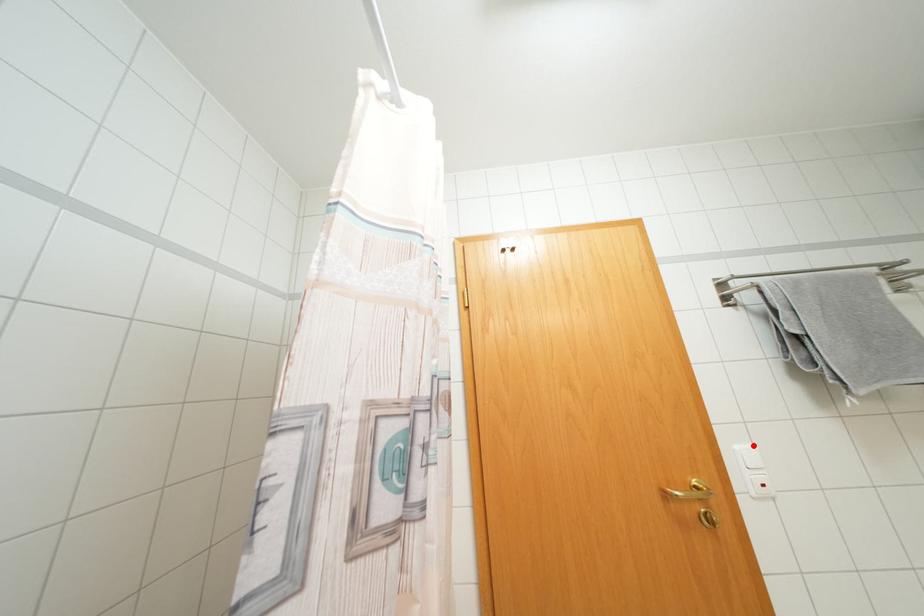
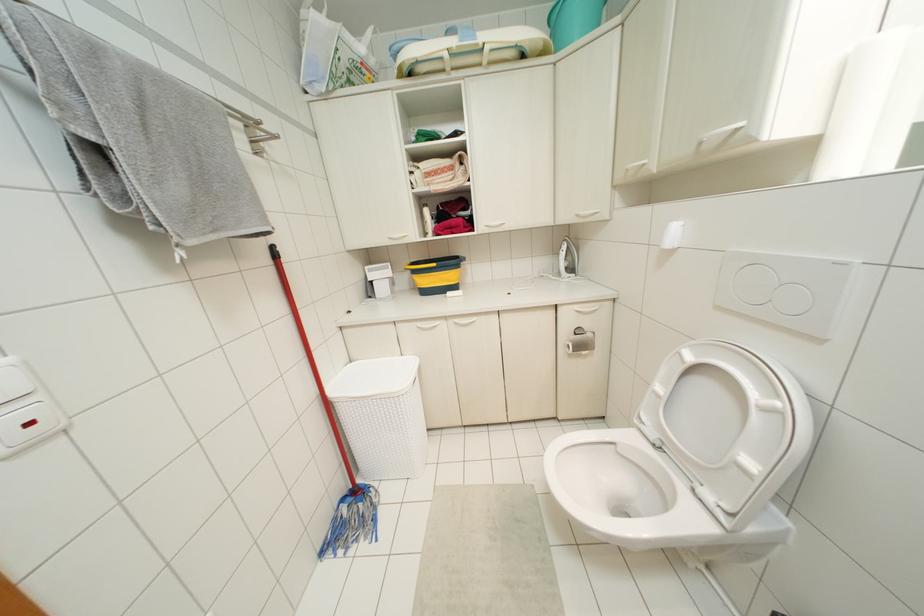
Where in the second image is the point corresponding to the highlighted location from the first image?

(7, 360)